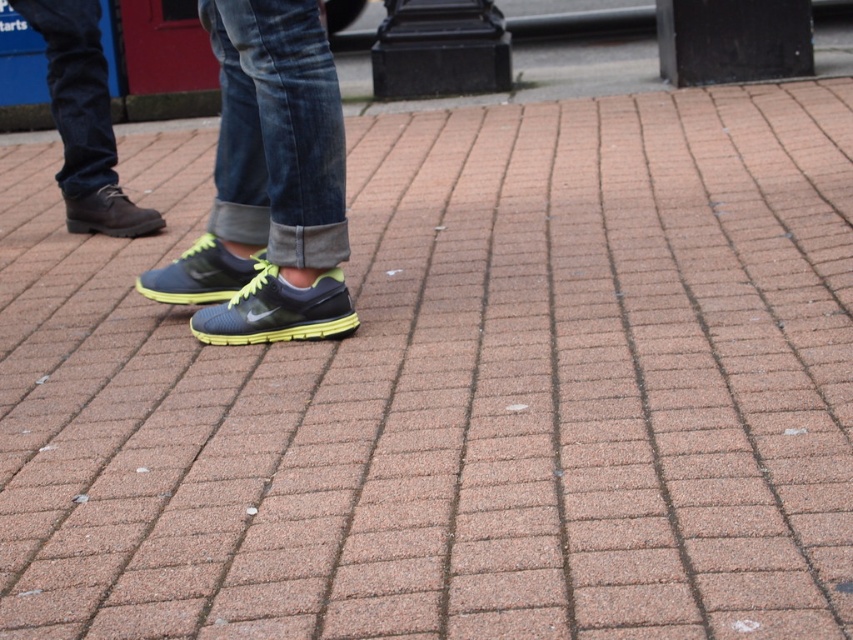
You are standing on the brick pavement and want to move forward without stepping on either the matte leather shoe at left or the matte brown boot at left. Which direction should you move to avoid both?

The matte leather shoe at left is in front of the matte brown boot at left, so you should move to the right to avoid both objects since they are positioned to the left side.